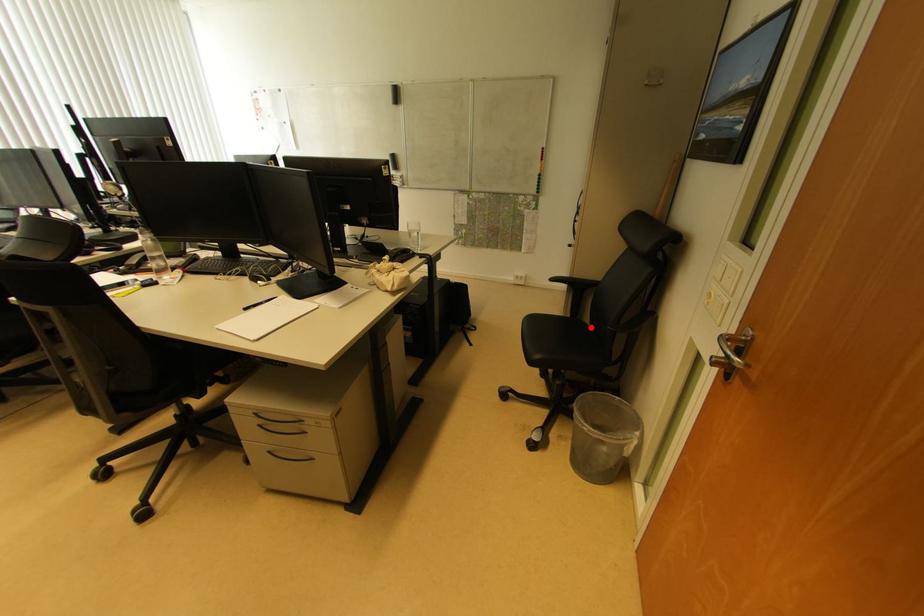
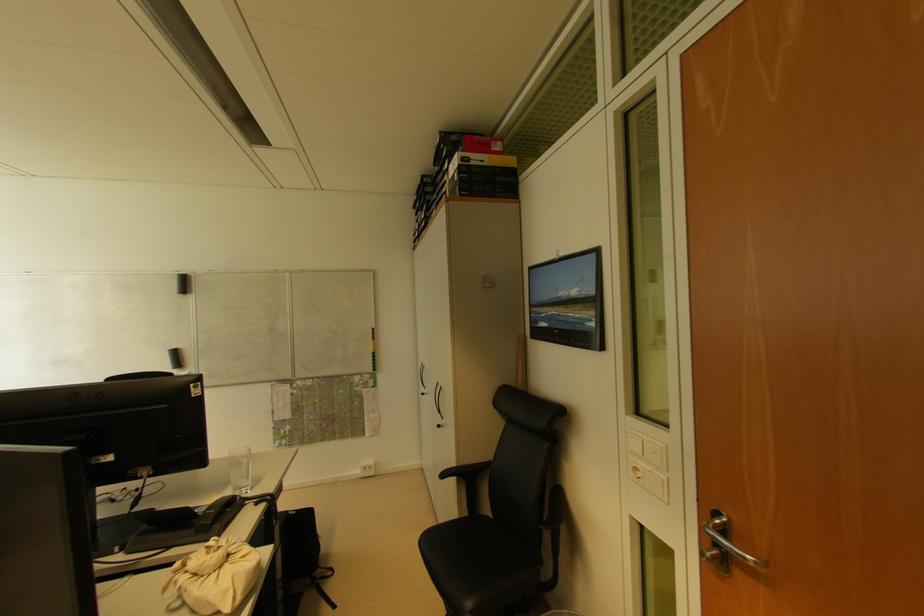
In the second image, find the point that corresponds to the highlighted location in the first image.

(493, 520)